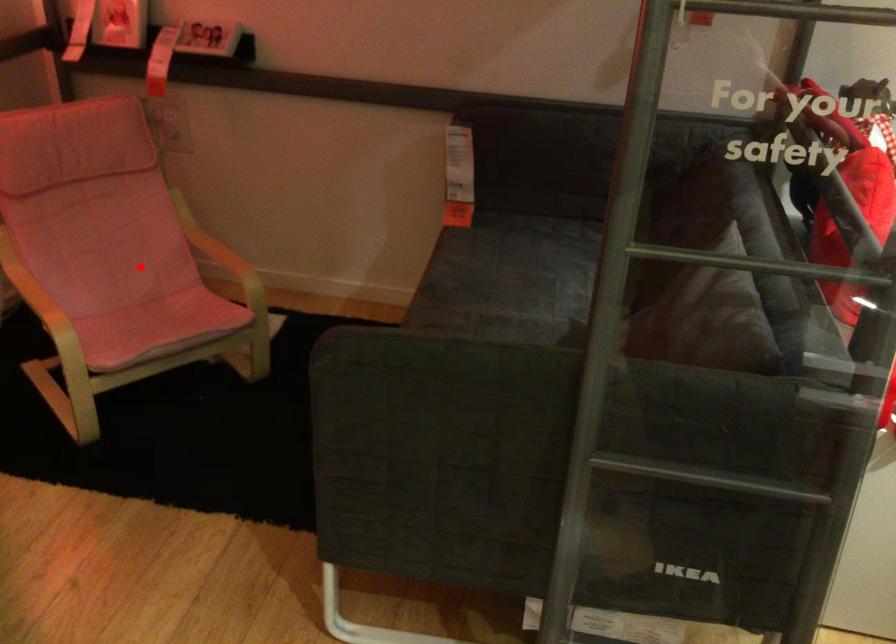
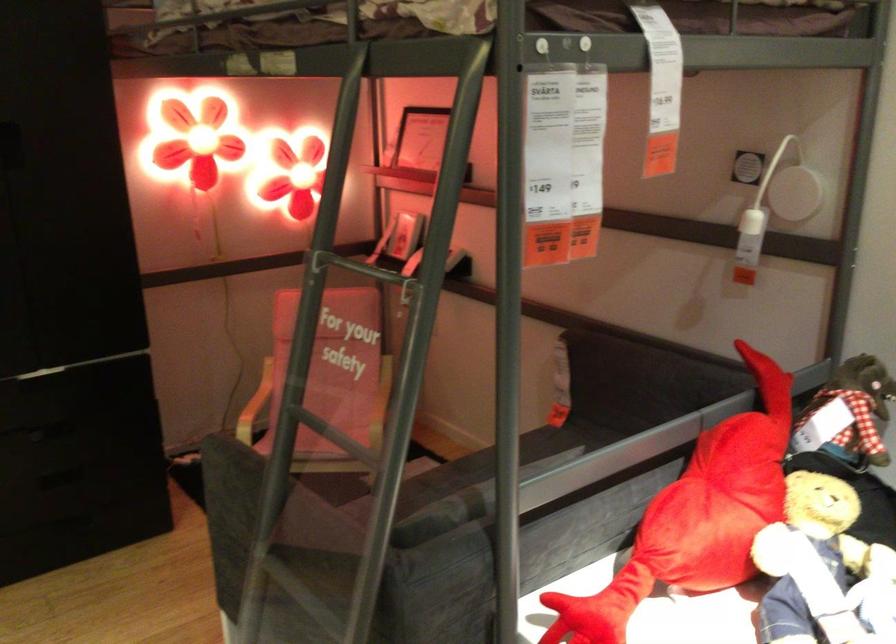
Locate, in the second image, the point that corresponds to the highlighted location in the first image.

(331, 404)